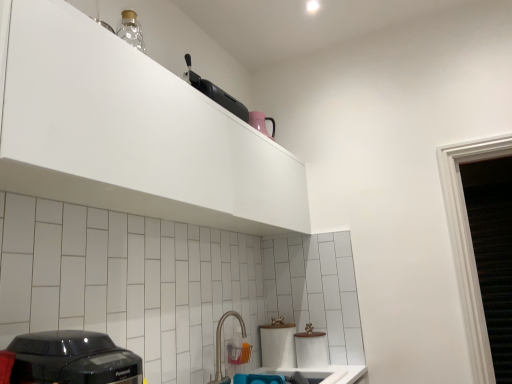
You are a GUI agent. You are given a task and a screenshot of the screen. Output one action in this format:
    pyautogui.click(x=<x>, y=<y>)
    Task: Click on the black plastic toaster at lower left
    
    Given the screenshot: What is the action you would take?
    pyautogui.click(x=72, y=359)

Image resolution: width=512 pixels, height=384 pixels. What are the coordinates of `white matte cabinet at upper center` in the screenshot? It's located at (133, 133).

The width and height of the screenshot is (512, 384). What are the coordinates of `black plastic toaster at lower left` in the screenshot? It's located at (72, 359).

Which object is closer to the camera taking this photo, white matte cabinet at upper center or black plastic toaster at upper center?

white matte cabinet at upper center is more forward.

Is white matte cabinet at upper center wider or thinner than black plastic toaster at upper center?

Clearly, white matte cabinet at upper center has more width compared to black plastic toaster at upper center.

Image resolution: width=512 pixels, height=384 pixels. I want to click on cabinetry located below the black plastic toaster at upper center (from the image's perspective), so click(133, 133).

Based on the photo, is white matte cabinet at upper center aimed at black plastic toaster at upper center?

No, white matte cabinet at upper center is not oriented towards black plastic toaster at upper center.

Between white matte cabinet at upper center and black plastic toaster at lower left, which one appears on the right side from the viewer's perspective?

Positioned to the right is white matte cabinet at upper center.

Is white matte cabinet at upper center turned away from black plastic toaster at lower left?

No, white matte cabinet at upper center is not facing away from black plastic toaster at lower left.

Is white matte cabinet at upper center smaller than black plastic toaster at lower left?

Actually, white matte cabinet at upper center might be larger than black plastic toaster at lower left.

Which object is more forward, satin nickel faucet at lower center or white glossy sink at lower center?

white glossy sink at lower center is more forward.

Is satin nickel faucet at lower center spatially inside white glossy sink at lower center, or outside of it?

satin nickel faucet at lower center is located beyond the bounds of white glossy sink at lower center.

Does satin nickel faucet at lower center appear on the left side of white glossy sink at lower center?

Correct, you'll find satin nickel faucet at lower center to the left of white glossy sink at lower center.

Can you confirm if satin nickel faucet at lower center is bigger than white glossy sink at lower center?

Actually, satin nickel faucet at lower center might be smaller than white glossy sink at lower center.

Is point (48, 342) closer or farther from the camera than point (303, 373)?

Clearly, point (48, 342) is closer to the camera than point (303, 373).

Is black plastic toaster at lower left surrounding white glossy sink at lower center?

No, white glossy sink at lower center is located outside of black plastic toaster at lower left.

Which object is further away from the camera taking this photo, black plastic toaster at lower left or white glossy sink at lower center?

Positioned behind is white glossy sink at lower center.

The height and width of the screenshot is (384, 512). Find the location of `counter top below the black plastic toaster at lower left (from a real-world perspective)`. counter top below the black plastic toaster at lower left (from a real-world perspective) is located at coordinates (323, 373).

Would you say black plastic toaster at lower left is a long distance from satin nickel faucet at lower center?

Yes, black plastic toaster at lower left is far from satin nickel faucet at lower center.

Which object is thinner, black plastic toaster at lower left or satin nickel faucet at lower center?

With smaller width is satin nickel faucet at lower center.

Where is `faucet located on the right of black plastic toaster at lower left`? faucet located on the right of black plastic toaster at lower left is located at coordinates (220, 346).

Which object is closer to the camera taking this photo, black plastic toaster at lower left or satin nickel faucet at lower center?

Positioned in front is black plastic toaster at lower left.

Looking at the image, does black plastic toaster at upper center seem bigger or smaller compared to satin nickel faucet at lower center?

In the image, black plastic toaster at upper center appears to be larger than satin nickel faucet at lower center.

Locate an element on the screen. This screenshot has width=512, height=384. faucet that is under the black plastic toaster at upper center (from a real-world perspective) is located at coordinates (220, 346).

Which of these two, black plastic toaster at upper center or satin nickel faucet at lower center, stands shorter?

Standing shorter between the two is black plastic toaster at upper center.

Is white matte cabinet at upper center positioned behind white glossy sink at lower center?

No, it is not.

Is white glossy sink at lower center at the back of white matte cabinet at upper center?

No, white matte cabinet at upper center is not facing away from white glossy sink at lower center.

From the image's perspective, is white matte cabinet at upper center on top of white glossy sink at lower center?

Yes.

Considering the relative sizes of white matte cabinet at upper center and white glossy sink at lower center in the image provided, is white matte cabinet at upper center thinner than white glossy sink at lower center?

Correct, the width of white matte cabinet at upper center is less than that of white glossy sink at lower center.

The width and height of the screenshot is (512, 384). I want to click on cabinetry that is under the black plastic toaster at upper center (from a real-world perspective), so click(133, 133).

In the image, there is a white matte cabinet at upper center. At what (x,y) coordinates should I click in order to perform the action: click on home appliance below it (from the image's perspective). Please return your answer as a coordinate pair (x, y). Looking at the image, I should click on (72, 359).

When comparing their distances from white matte cabinet at upper center, does black plastic toaster at upper center or satin nickel faucet at lower center seem further?

The object further to white matte cabinet at upper center is satin nickel faucet at lower center.

Considering their positions, is white matte cabinet at upper center positioned closer to black plastic toaster at upper center than white glossy sink at lower center?

Among the two, white matte cabinet at upper center is located nearer to black plastic toaster at upper center.

Based on their spatial positions, is white glossy sink at lower center or satin nickel faucet at lower center further from white matte cabinet at upper center?

white glossy sink at lower center lies further to white matte cabinet at upper center than the other object.

Considering their positions, is white matte cabinet at upper center positioned further to satin nickel faucet at lower center than white glossy sink at lower center?

Among the two, white matte cabinet at upper center is located further to satin nickel faucet at lower center.

Considering their positions, is white glossy sink at lower center positioned closer to white matte cabinet at upper center than black plastic toaster at lower left?

black plastic toaster at lower left is closer to white matte cabinet at upper center.

Based on their spatial positions, is satin nickel faucet at lower center or white glossy sink at lower center closer to black plastic toaster at upper center?

satin nickel faucet at lower center is closer to black plastic toaster at upper center.

From the image, which object appears to be farther from white matte cabinet at upper center, black plastic toaster at upper center or black plastic toaster at lower left?

Based on the image, black plastic toaster at lower left appears to be further to white matte cabinet at upper center.

Considering their positions, is white glossy sink at lower center positioned further to black plastic toaster at lower left than black plastic toaster at upper center?

Based on the image, white glossy sink at lower center appears to be further to black plastic toaster at lower left.

You are a GUI agent. You are given a task and a screenshot of the screen. Output one action in this format:
    pyautogui.click(x=<x>, y=<y>)
    Task: Click on the counter top located between black plastic toaster at lower left and satin nickel faucet at lower center in the depth direction
    Image resolution: width=512 pixels, height=384 pixels.
    Given the screenshot: What is the action you would take?
    pyautogui.click(x=323, y=373)

This screenshot has height=384, width=512. Identify the location of cabinetry between black plastic toaster at upper center and satin nickel faucet at lower center from top to bottom. (x=133, y=133).

You are a GUI agent. You are given a task and a screenshot of the screen. Output one action in this format:
    pyautogui.click(x=<x>, y=<y>)
    Task: Click on the home appliance between white matte cabinet at upper center and white glossy sink at lower center vertically
    This screenshot has width=512, height=384.
    Given the screenshot: What is the action you would take?
    pyautogui.click(x=72, y=359)

Locate an element on the screen. home appliance between black plastic toaster at upper center and satin nickel faucet at lower center vertically is located at coordinates (72, 359).